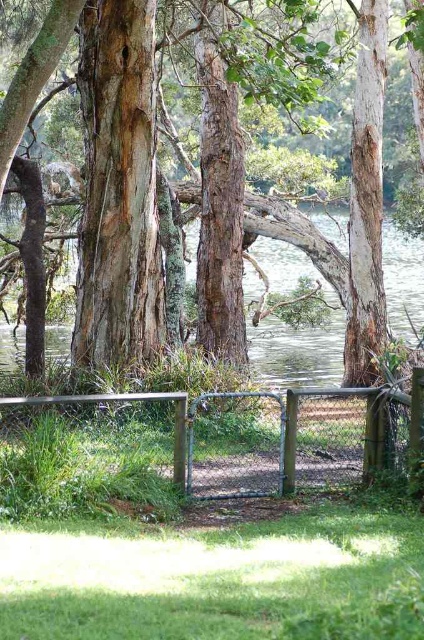
You are standing at the entrance of the pathway and want to locate the clear water at center. Based on the coordinates given, in which direction should you walk to reach it?

The clear water at center is located at coordinates point (295, 330), so you should walk forward along the pathway towards the center of the scene to reach it.

You are planning to build a small wooden bridge over the clear water at center. The bridge needs to be 3 meters wide to accommodate a cart. Based on the scene, will the rough bark tree at center interfere with the bridge construction?

The rough bark tree at center has a width less than the clear water at center, so the tree is narrower than the water area. Since the bridge needs to span the water, which is wider than the tree, the tree might not directly interfere, but its exact position relative to the water path must be considered for construction planning.